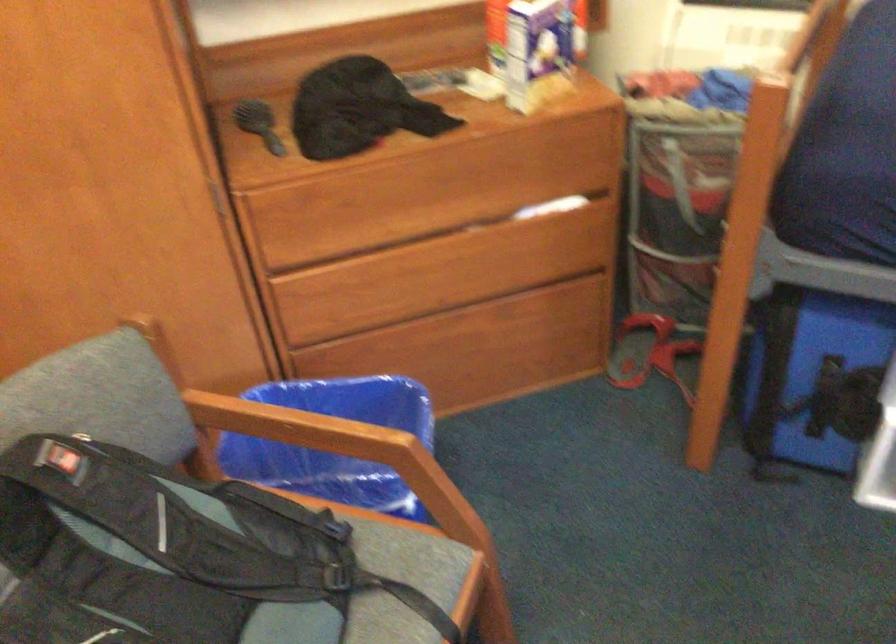
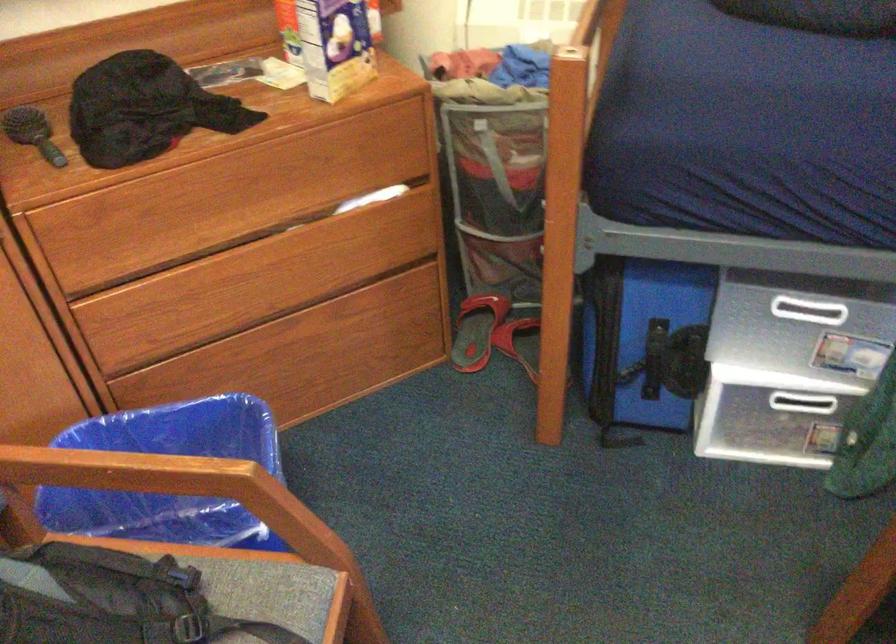
Question: The camera is either moving clockwise (left) or counter-clockwise (right) around the object. The first image is from the beginning of the video and the second image is from the end. Is the camera moving left or right when shooting the video?

Choices:
 (A) Left
 (B) Right

Answer: (A)